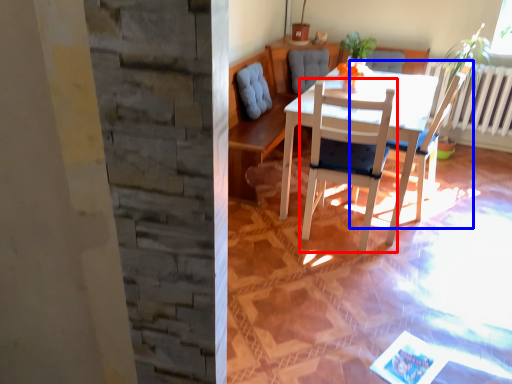
Question: Among these objects, which one is farthest to the camera, chair (highlighted by a red box) or chair (highlighted by a blue box)?

Choices:
 (A) chair
 (B) chair

Answer: (B)